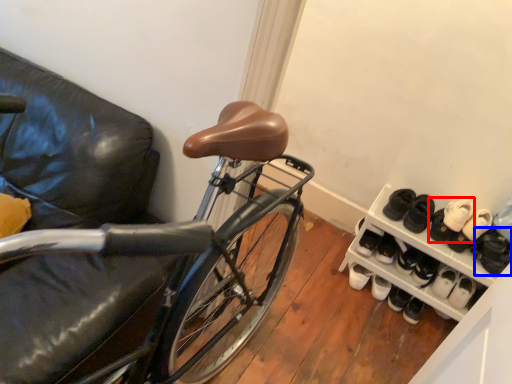
Question: Which point is further to the camera, footwear (highlighted by a red box) or footwear (highlighted by a blue box)?

Choices:
 (A) footwear
 (B) footwear

Answer: (A)